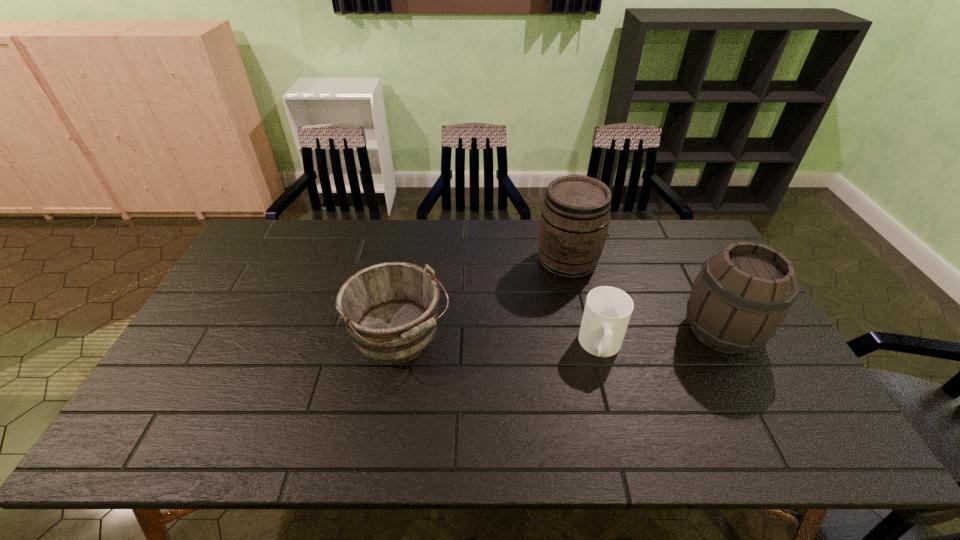
Identify the location of object at the far edge. (574, 222).

The width and height of the screenshot is (960, 540). Identify the location of object present at the right edge. (743, 293).

Locate an element on the screen. vacant region at the far edge is located at coordinates (440, 258).

You are a GUI agent. You are given a task and a screenshot of the screen. Output one action in this format:
    pyautogui.click(x=<x>, y=<y>)
    Task: Click on the free location at the near edge of the desktop
    Image resolution: width=960 pixels, height=540 pixels.
    Given the screenshot: What is the action you would take?
    pyautogui.click(x=396, y=440)

I want to click on vacant space at the left edge of the desktop, so click(x=169, y=406).

This screenshot has height=540, width=960. What are the coordinates of `vacant space at the right edge of the desktop` in the screenshot? It's located at (693, 273).

Find the location of `vacant area at the near left corner of the desktop`. vacant area at the near left corner of the desktop is located at coordinates (131, 455).

The height and width of the screenshot is (540, 960). I want to click on vacant region between the leftmost object and the second wine bucket from left to right, so click(x=484, y=299).

Where is `free area in between the leftmost object and the mug`? The height and width of the screenshot is (540, 960). free area in between the leftmost object and the mug is located at coordinates (500, 341).

Identify the location of free area in between the mug and the leftmost object. The width and height of the screenshot is (960, 540). (500, 341).